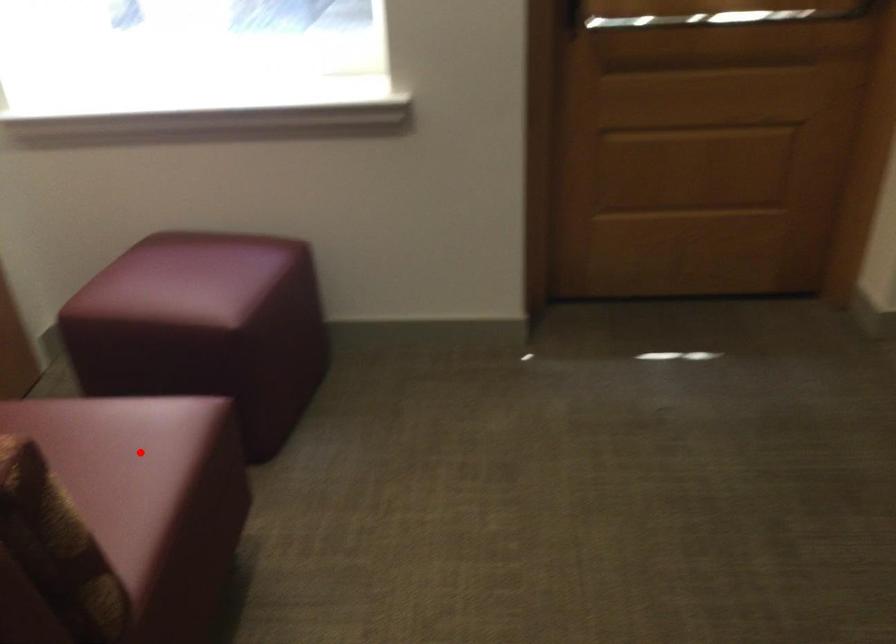
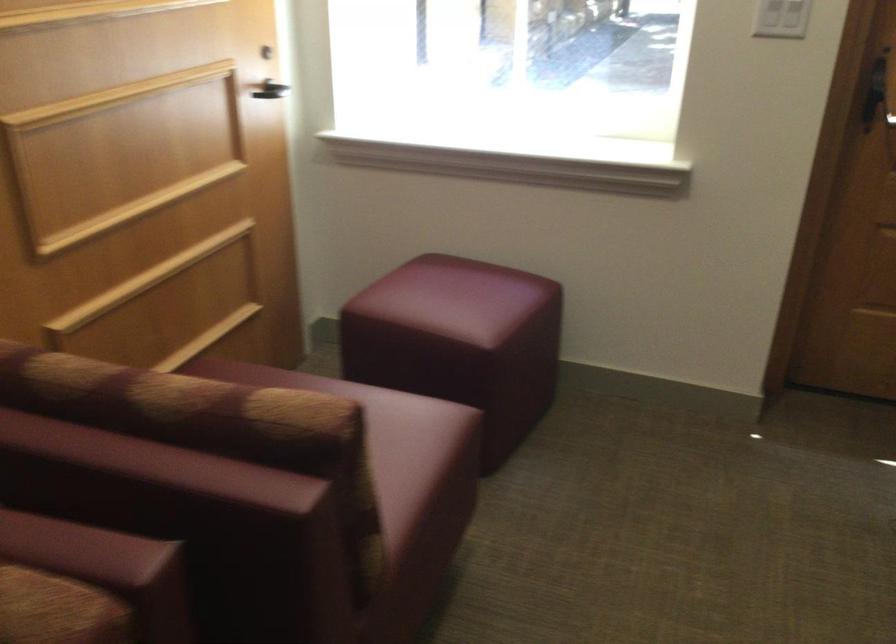
Question: I am providing you with two images of the same scene from different viewpoints. In image1, a red point is highlighted. Considering the same 3D point in image2, which of the following is correct?

Choices:
 (A) It is closer
 (B) It is farther

Answer: (B)